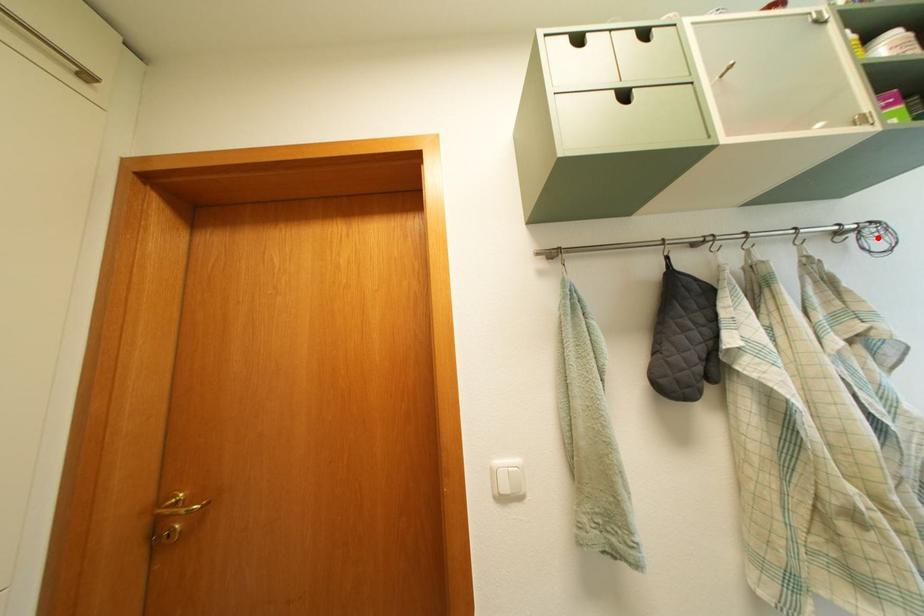
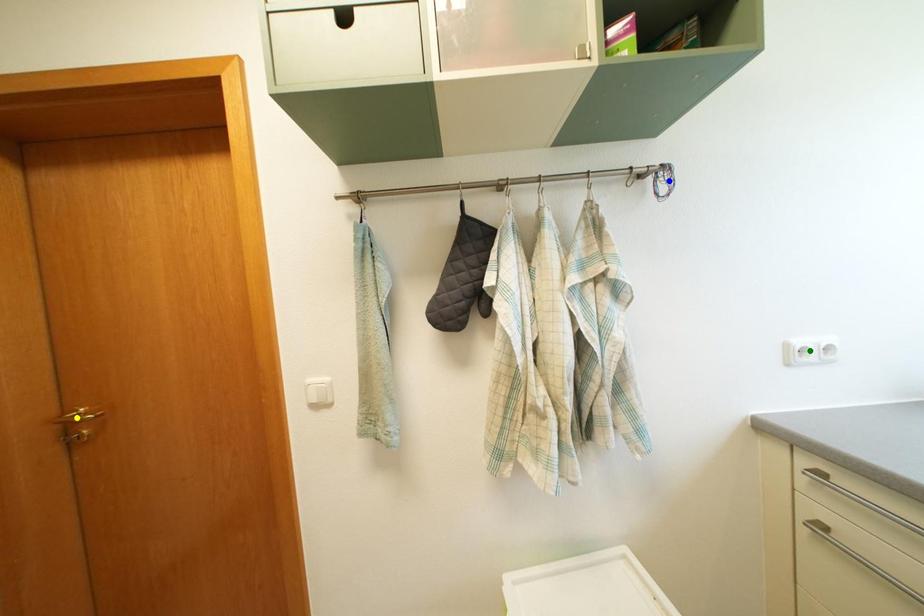
Question: I am providing you with two images of the same scene from different viewpoints. A red point is marked on the first image. You are given multiple points on the second image. In image 2, which mark is for the same physical point as the one in image 1?

Choices:
 (A) yellow point
 (B) blue point
 (C) green point

Answer: (B)